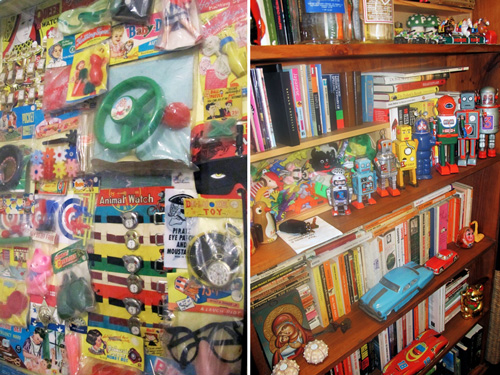
In order to click on toy car in this screenshot , I will do click(x=403, y=288), click(x=417, y=354), click(x=445, y=260).